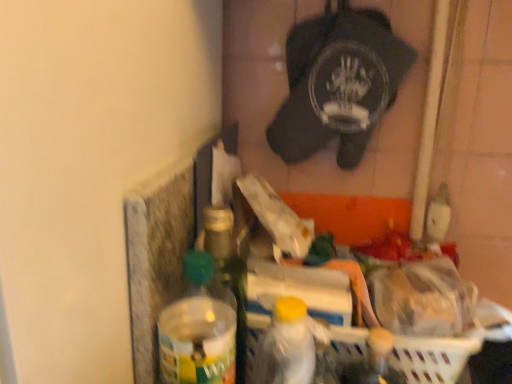
Question: Is point (185, 382) closer or farther from the camera than point (338, 349)?

Choices:
 (A) closer
 (B) farther

Answer: (A)

Question: Considering the positions of translucent plastic bottle at center, positioned as the 1th bottle in left-to-right order, and white plastic basket at lower right in the image, is translucent plastic bottle at center, positioned as the 1th bottle in left-to-right order, taller or shorter than white plastic basket at lower right?

Choices:
 (A) short
 (B) tall

Answer: (B)

Question: Considering the real-world distances, which object is farthest from the translucent plastic bottle at center, positioned as the 1th bottle in left-to-right order?

Choices:
 (A) white plastic bottle at center, the 3th bottle positioned from the left
 (B) white plastic basket at lower right
 (C) translucent plastic bottle at center, which is the second bottle in left-to-right order

Answer: (B)

Question: Which is farther from the white plastic bottle at center, the first bottle positioned from the right?

Choices:
 (A) translucent plastic bottle at center, which is the second bottle in left-to-right order
 (B) translucent plastic bottle at center, which is the third bottle in right-to-left order
 (C) white plastic basket at lower right

Answer: (C)